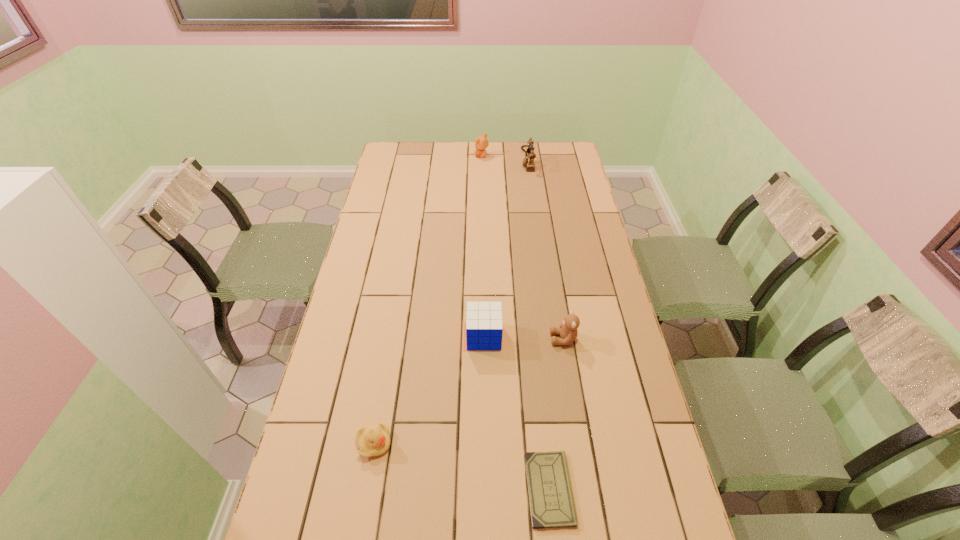
Identify the location of free space located on the face of the left teddy bear. (431, 156).

Identify the location of free space located on the face of the left teddy bear. The height and width of the screenshot is (540, 960). (413, 156).

Where is `blank space located 0.120m on the face of the left teddy bear`? This screenshot has width=960, height=540. blank space located 0.120m on the face of the left teddy bear is located at coordinates (450, 156).

Locate an element on the screen. The height and width of the screenshot is (540, 960). free point located on the face of the nearer teddy bear is located at coordinates (447, 339).

Identify the location of vacant region located on the face of the nearer teddy bear. (509, 339).

Where is `vacant region located 0.290m on the face of the nearer teddy bear`? vacant region located 0.290m on the face of the nearer teddy bear is located at coordinates (457, 339).

The image size is (960, 540). I want to click on vacant region located on the front of the cube, so click(485, 386).

The height and width of the screenshot is (540, 960). Find the location of `free space located 0.060m on the beak of the duckling`. free space located 0.060m on the beak of the duckling is located at coordinates (415, 444).

The image size is (960, 540). What are the coordinates of `vacant space located 0.300m on the left of the shortest object` in the screenshot? It's located at (402, 489).

Identify the location of telephone that is at the far edge. This screenshot has height=540, width=960. (528, 162).